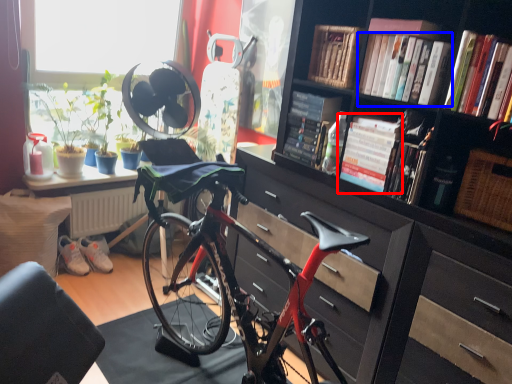
Question: Among these objects, which one is farthest to the camera, book (highlighted by a red box) or book (highlighted by a blue box)?

Choices:
 (A) book
 (B) book

Answer: (A)